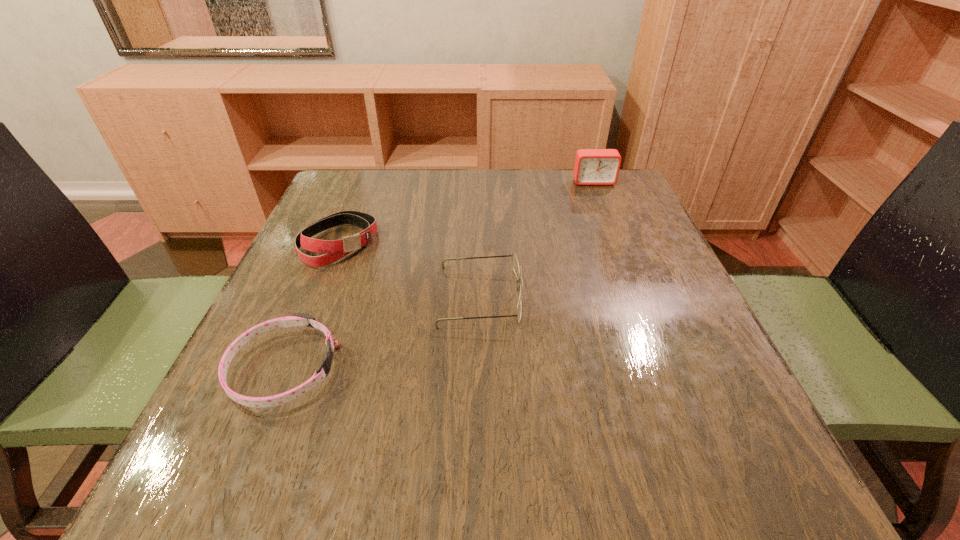
Identify the location of object at the far edge. This screenshot has width=960, height=540. (592, 166).

Where is `object present at the right edge`? The height and width of the screenshot is (540, 960). object present at the right edge is located at coordinates 592,166.

At what (x,y) coordinates should I click in order to perform the action: click on object that is at the far right corner. Please return your answer as a coordinate pair (x, y). This screenshot has height=540, width=960. Looking at the image, I should click on (592, 166).

Where is `blank space at the far edge`? This screenshot has width=960, height=540. blank space at the far edge is located at coordinates (472, 177).

In the image, there is a desktop. Where is `vacant space at the left edge`? The width and height of the screenshot is (960, 540). vacant space at the left edge is located at coordinates (280, 295).

The width and height of the screenshot is (960, 540). I want to click on vacant region at the right edge of the desktop, so click(642, 226).

This screenshot has height=540, width=960. In the image, there is a desktop. Find the location of `vacant space at the near left corner`. vacant space at the near left corner is located at coordinates (220, 475).

Identify the location of free space at the far right corner of the desktop. This screenshot has width=960, height=540. (608, 211).

The image size is (960, 540). In the image, there is a desktop. Identify the location of vacant space at the near right corner. (706, 447).

Image resolution: width=960 pixels, height=540 pixels. I want to click on blank region between the farther dog collar and the spectacles, so click(x=409, y=270).